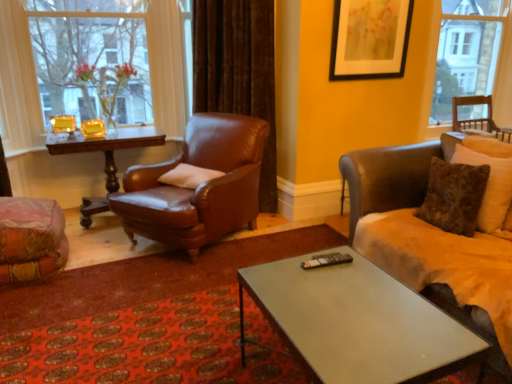
Locate an element on the screen. The height and width of the screenshot is (384, 512). free space in front of black plastic remote control at center is located at coordinates (333, 278).